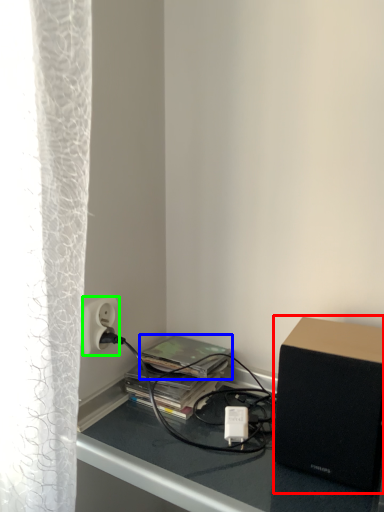
Question: Based on their relative distances, which object is nearer to loudspeaker (highlighted by a red box)? Choose from paperback book (highlighted by a blue box) and power outlet (highlighted by a green box).

Choices:
 (A) paperback book
 (B) power outlet

Answer: (A)